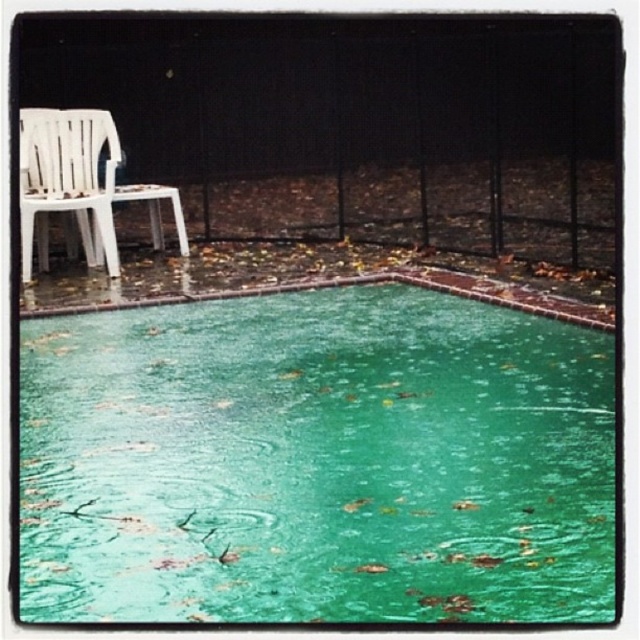
Can you confirm if green glossy water at center is taller than white plastic chair at left?

Incorrect, green glossy water at center's height is not larger of white plastic chair at left's.

Looking at this image, is green glossy water at center to the left of white plastic chair at left from the viewer's perspective?

No, green glossy water at center is not to the left of white plastic chair at left.

Measure the distance between point (371, 477) and camera.

Point (371, 477) and camera are 4.40 meters apart from each other.

Locate an element on the screen. This screenshot has height=640, width=640. green glossy water at center is located at coordinates (316, 461).

Between green glossy water at center and black metal fence at upper center, which one has more height?

black metal fence at upper center

Describe the element at coordinates (316, 461) in the screenshot. I see `green glossy water at center` at that location.

This screenshot has height=640, width=640. I want to click on green glossy water at center, so click(x=316, y=461).

Who is lower down, black metal fence at upper center or white plastic chair at left?

white plastic chair at left is below.

Which is more to the right, black metal fence at upper center or white plastic chair at left?

black metal fence at upper center

What are the coordinates of `black metal fence at upper center` in the screenshot? It's located at (356, 122).